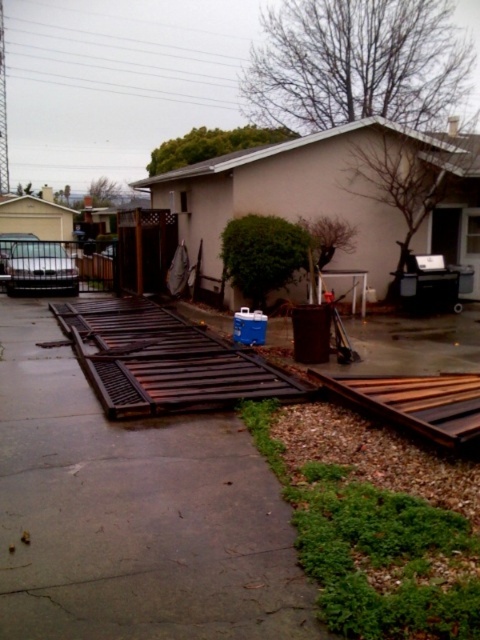
Consider the image. Is brown wooden planks at center taller than brown metal train track at center?

Yes, brown wooden planks at center is taller than brown metal train track at center.

Who is taller, brown wooden planks at center or brown metal train track at center?

brown wooden planks at center is taller.

Between point (224, 440) and point (274, 376), which one is positioned behind?

The point (274, 376) is more distant.

Find the location of a particular element. brown wooden planks at center is located at coordinates (132, 513).